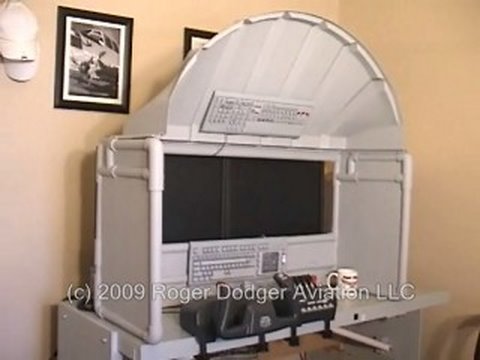
Locate an element on the screen. This screenshot has width=480, height=360. white mug with bird logo is located at coordinates (343, 283).